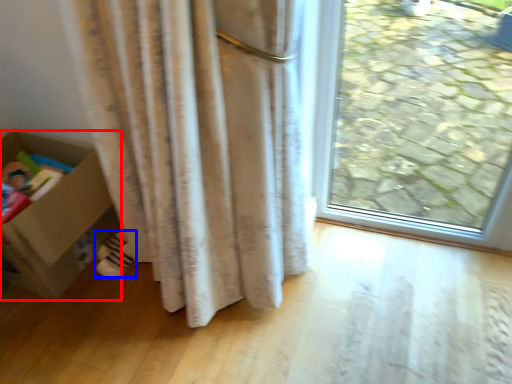
Question: Which object appears farthest to the camera in this image, box (highlighted by a red box) or footwear (highlighted by a blue box)?

Choices:
 (A) box
 (B) footwear

Answer: (B)